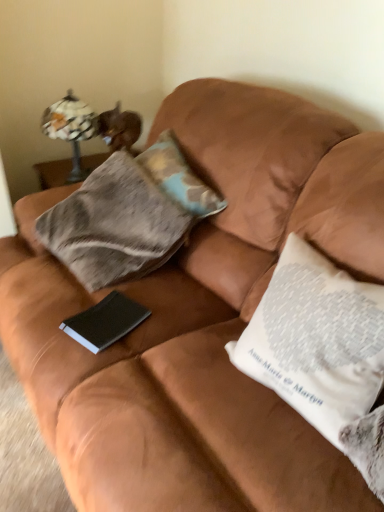
Find the location of a particular element. The width and height of the screenshot is (384, 512). white printed pillow at right, which ranks as the 1th pillow in bottom-to-top order is located at coordinates (316, 340).

What do you see at coordinates (316, 340) in the screenshot?
I see `white printed pillow at right, which ranks as the 1th pillow in bottom-to-top order` at bounding box center [316, 340].

This screenshot has height=512, width=384. I want to click on black matte paper at center, so click(105, 322).

The image size is (384, 512). What do you see at coordinates (71, 128) in the screenshot?
I see `matte glass lamp at upper left` at bounding box center [71, 128].

At what (x,y) coordinates should I click in order to perform the action: click on matte glass lamp at upper left. Please return your answer as a coordinate pair (x, y). Looking at the image, I should click on (71, 128).

Identify the location of camouflage fabric pillow at center, arranged as the second pillow when viewed from the front. The height and width of the screenshot is (512, 384). (179, 177).

Would you say black matte paper at center is part of white printed pillow at right, placed as the 2th pillow when sorted from top to bottom,'s contents?

No.

Is white printed pillow at right, which ranks as the 1th pillow in bottom-to-top order, far away from black matte paper at center?

white printed pillow at right, which ranks as the 1th pillow in bottom-to-top order, is actually quite close to black matte paper at center.

Consider the image. How different are the orientations of white printed pillow at right, which ranks as the 1th pillow in bottom-to-top order, and black matte paper at center in degrees?

The facing directions of white printed pillow at right, which ranks as the 1th pillow in bottom-to-top order, and black matte paper at center are 10.4 degrees apart.

Is white printed pillow at right, arranged as the 2th pillow when viewed from the back, oriented towards camouflage fabric pillow at center, which appears as the first pillow when viewed from the back?

No.

From the image's perspective, which one is positioned higher, white printed pillow at right, which ranks as the 1th pillow in bottom-to-top order, or camouflage fabric pillow at center, positioned as the first pillow in top-to-bottom order?

camouflage fabric pillow at center, positioned as the first pillow in top-to-bottom order, from the image's perspective.

Where is `pillow above the white printed pillow at right, the first pillow in the front-to-back sequence (from the image's perspective)`? This screenshot has height=512, width=384. pillow above the white printed pillow at right, the first pillow in the front-to-back sequence (from the image's perspective) is located at coordinates (179, 177).

From a real-world perspective, is white printed pillow at right, the first pillow in the front-to-back sequence, physically located above or below camouflage fabric pillow at center, which appears as the first pillow when viewed from the back?

white printed pillow at right, the first pillow in the front-to-back sequence, is below camouflage fabric pillow at center, which appears as the first pillow when viewed from the back.

Can you confirm if black matte paper at center is smaller than matte glass lamp at upper left?

Indeed, black matte paper at center has a smaller size compared to matte glass lamp at upper left.

Which object is wider, black matte paper at center or matte glass lamp at upper left?

With larger width is matte glass lamp at upper left.

Measure the distance from black matte paper at center to matte glass lamp at upper left.

black matte paper at center and matte glass lamp at upper left are 36.86 inches apart.

I want to click on paperback book located below the matte glass lamp at upper left (from the image's perspective), so click(x=105, y=322).

Which is further, (93,339) or (348,327)?

Point (93,339)

Between black matte paper at center and white printed pillow at right, placed as the 2th pillow when sorted from top to bottom, which one has less height?

With less height is black matte paper at center.

Does black matte paper at center turn towards white printed pillow at right, which ranks as the 1th pillow in bottom-to-top order?

No, black matte paper at center is not aimed at white printed pillow at right, which ranks as the 1th pillow in bottom-to-top order.

From a real-world perspective, is black matte paper at center under white printed pillow at right, placed as the 2th pillow when sorted from top to bottom?

Yes, from a real-world perspective, black matte paper at center is below white printed pillow at right, placed as the 2th pillow when sorted from top to bottom.

Is point (208, 208) positioned before point (130, 321)?

No, it is behind (130, 321).

Does camouflage fabric pillow at center, positioned as the first pillow in top-to-bottom order, come behind black matte paper at center?

Yes, the depth of camouflage fabric pillow at center, positioned as the first pillow in top-to-bottom order, is greater than that of black matte paper at center.

What's the angular difference between camouflage fabric pillow at center, positioned as the first pillow in top-to-bottom order, and black matte paper at center's facing directions?

15.7 degrees separate the facing orientations of camouflage fabric pillow at center, positioned as the first pillow in top-to-bottom order, and black matte paper at center.

How different are the orientations of matte glass lamp at upper left and black matte paper at center in degrees?

66.9 degrees separate the facing orientations of matte glass lamp at upper left and black matte paper at center.

Considering the positions of objects matte glass lamp at upper left and black matte paper at center in the image provided, who is more to the left, matte glass lamp at upper left or black matte paper at center?

matte glass lamp at upper left.

Is matte glass lamp at upper left completely or partially outside of black matte paper at center?

Yes, matte glass lamp at upper left is outside of black matte paper at center.

What's the angular difference between camouflage fabric pillow at center, which appears as the first pillow when viewed from the back, and matte glass lamp at upper left's facing directions?

There is a 82.6-degree angle between the facing directions of camouflage fabric pillow at center, which appears as the first pillow when viewed from the back, and matte glass lamp at upper left.

You are a GUI agent. You are given a task and a screenshot of the screen. Output one action in this format:
    pyautogui.click(x=<x>, y=<y>)
    Task: Click on the pillow that is the 1st one when counting forward from the matte glass lamp at upper left
    The image size is (384, 512).
    Given the screenshot: What is the action you would take?
    pyautogui.click(x=179, y=177)

Who is taller, camouflage fabric pillow at center, positioned as the 2th pillow in bottom-to-top order, or matte glass lamp at upper left?

matte glass lamp at upper left.

Which object is thinner, camouflage fabric pillow at center, arranged as the second pillow when viewed from the front, or matte glass lamp at upper left?

Thinner between the two is camouflage fabric pillow at center, arranged as the second pillow when viewed from the front.

In order to click on the 1st pillow above the black matte paper at center (from the image's perspective) in this screenshot , I will do `click(316, 340)`.

What are the coordinates of `pillow on the left of white printed pillow at right, the first pillow in the front-to-back sequence` in the screenshot? It's located at (179, 177).

From the image, which object appears to be farther from matte glass lamp at upper left, white printed pillow at right, arranged as the 2th pillow when viewed from the back, or black matte paper at center?

The object further to matte glass lamp at upper left is white printed pillow at right, arranged as the 2th pillow when viewed from the back.

When comparing their distances from black matte paper at center, does matte glass lamp at upper left or camouflage fabric pillow at center, arranged as the second pillow when viewed from the front, seem closer?

camouflage fabric pillow at center, arranged as the second pillow when viewed from the front, is closer to black matte paper at center.

Based on their spatial positions, is matte glass lamp at upper left or white printed pillow at right, arranged as the 2th pillow when viewed from the back, further from camouflage fabric pillow at center, which appears as the first pillow when viewed from the back?

white printed pillow at right, arranged as the 2th pillow when viewed from the back, is positioned further to the anchor camouflage fabric pillow at center, which appears as the first pillow when viewed from the back.

Estimate the real-world distances between objects in this image. Which object is closer to camouflage fabric pillow at center, which appears as the first pillow when viewed from the back, black matte paper at center or matte glass lamp at upper left?

Among the two, black matte paper at center is located nearer to camouflage fabric pillow at center, which appears as the first pillow when viewed from the back.

Based on their spatial positions, is camouflage fabric pillow at center, positioned as the first pillow in top-to-bottom order, or white printed pillow at right, the first pillow in the front-to-back sequence, closer to black matte paper at center?

camouflage fabric pillow at center, positioned as the first pillow in top-to-bottom order, is closer to black matte paper at center.

Based on their spatial positions, is white printed pillow at right, placed as the 2th pillow when sorted from top to bottom, or matte glass lamp at upper left closer to black matte paper at center?

The object closer to black matte paper at center is white printed pillow at right, placed as the 2th pillow when sorted from top to bottom.

Consider the image. Which object lies nearer to the anchor point white printed pillow at right, the first pillow in the front-to-back sequence, black matte paper at center or camouflage fabric pillow at center, positioned as the first pillow in top-to-bottom order?

black matte paper at center is positioned closer to the anchor white printed pillow at right, the first pillow in the front-to-back sequence.

Considering their positions, is camouflage fabric pillow at center, positioned as the 2th pillow in bottom-to-top order, positioned further to black matte paper at center than matte glass lamp at upper left?

matte glass lamp at upper left is further to black matte paper at center.

This screenshot has width=384, height=512. I want to click on paperback book between white printed pillow at right, arranged as the 2th pillow when viewed from the back, and matte glass lamp at upper left, along the z-axis, so click(x=105, y=322).

The width and height of the screenshot is (384, 512). I want to click on paperback book between white printed pillow at right, placed as the 2th pillow when sorted from top to bottom, and camouflage fabric pillow at center, arranged as the second pillow when viewed from the front, along the z-axis, so tap(105, 322).

This screenshot has width=384, height=512. Identify the location of pillow between white printed pillow at right, placed as the 2th pillow when sorted from top to bottom, and matte glass lamp at upper left, along the z-axis. (179, 177).